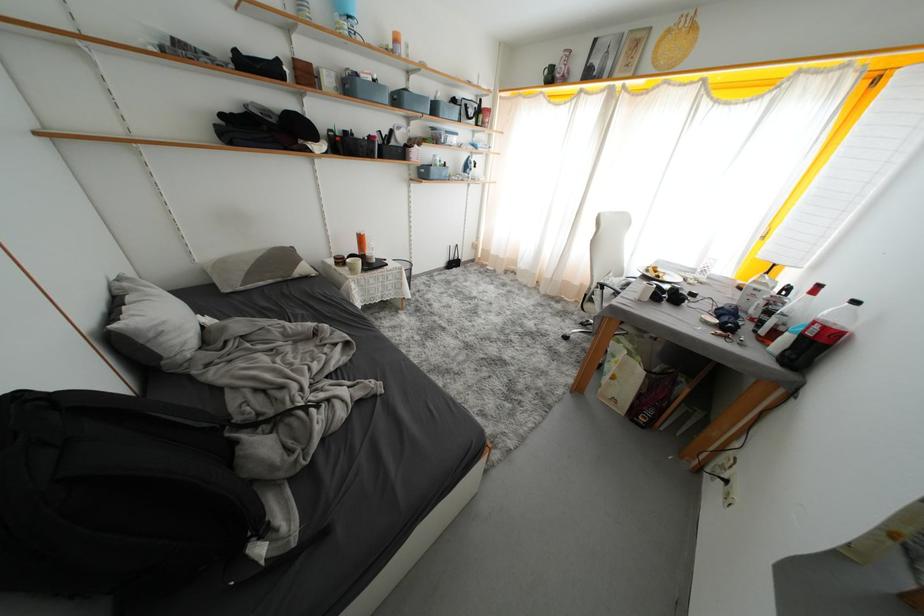
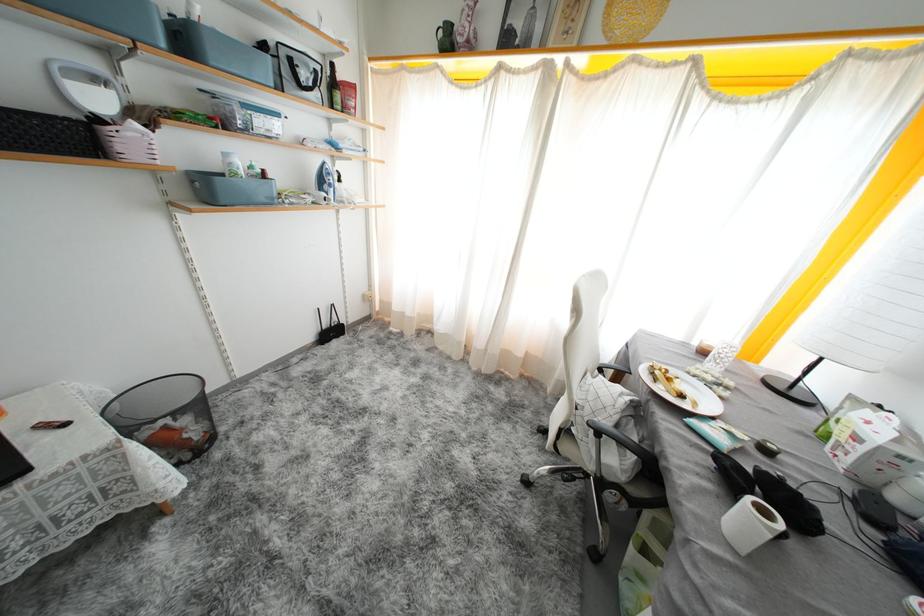
Find the pixel in the second image that matches (422,150) in the first image.

(141, 129)